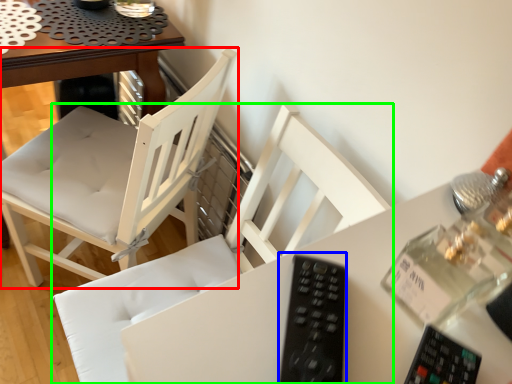
Question: Estimate the real-world distances between objects in this image. Which object is farther from chair (highlighted by a red box), remote (highlighted by a blue box) or chair (highlighted by a green box)?

Choices:
 (A) remote
 (B) chair

Answer: (A)